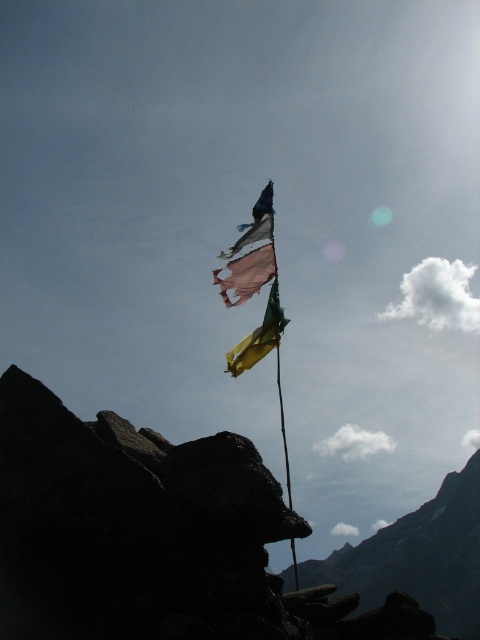
Does point (456, 484) lie in front of point (242, 371)?

No.

Who is more distant from viewer, (442, 604) or (260, 358)?

The point (442, 604) is behind.

The image size is (480, 640). Describe the element at coordinates (419, 557) in the screenshot. I see `rugged stone mountain at lower right` at that location.

You are a GUI agent. You are given a task and a screenshot of the screen. Output one action in this format:
    pyautogui.click(x=<x>, y=<y>)
    Task: Click on the rugged stone mountain at lower right
    Image resolution: width=480 pixels, height=640 pixels.
    Given the screenshot: What is the action you would take?
    pyautogui.click(x=419, y=557)

Between rugged stone mountain at lower right and ripped fabric flag at upper center, which one is positioned higher?

ripped fabric flag at upper center is above.

Can you confirm if rugged stone mountain at lower right is wider than ripped fabric flag at upper center?

Indeed, rugged stone mountain at lower right has a greater width compared to ripped fabric flag at upper center.

You are a GUI agent. You are given a task and a screenshot of the screen. Output one action in this format:
    pyautogui.click(x=<x>, y=<y>)
    Task: Click on the rugged stone mountain at lower right
    
    Given the screenshot: What is the action you would take?
    pyautogui.click(x=419, y=557)

At what (x,y) coordinates should I click in order to perform the action: click on rugged stone mountain at lower right. Please return your answer as a coordinate pair (x, y). Looking at the image, I should click on (419, 557).

Who is higher up, ripped fabric flag at upper center or yellow-green silk flag at center?

ripped fabric flag at upper center is higher up.

In the scene shown: Is ripped fabric flag at upper center bigger than yellow-green silk flag at center?

No, ripped fabric flag at upper center is not bigger than yellow-green silk flag at center.

Is point (238, 260) closer to camera compared to point (256, 352)?

No, it is behind (256, 352).

At what (x,y) coordinates should I click in order to perform the action: click on ripped fabric flag at upper center. Please return your answer as a coordinate pair (x, y). Image resolution: width=480 pixels, height=640 pixels. Looking at the image, I should click on (247, 275).